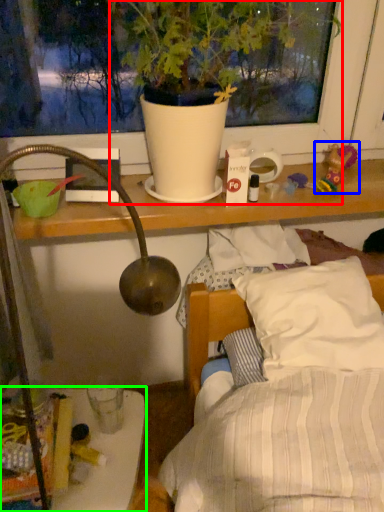
Question: Which is nearer to the houseplant (highlighted by a red box)? toy (highlighted by a blue box) or furniture (highlighted by a green box).

Choices:
 (A) toy
 (B) furniture

Answer: (A)